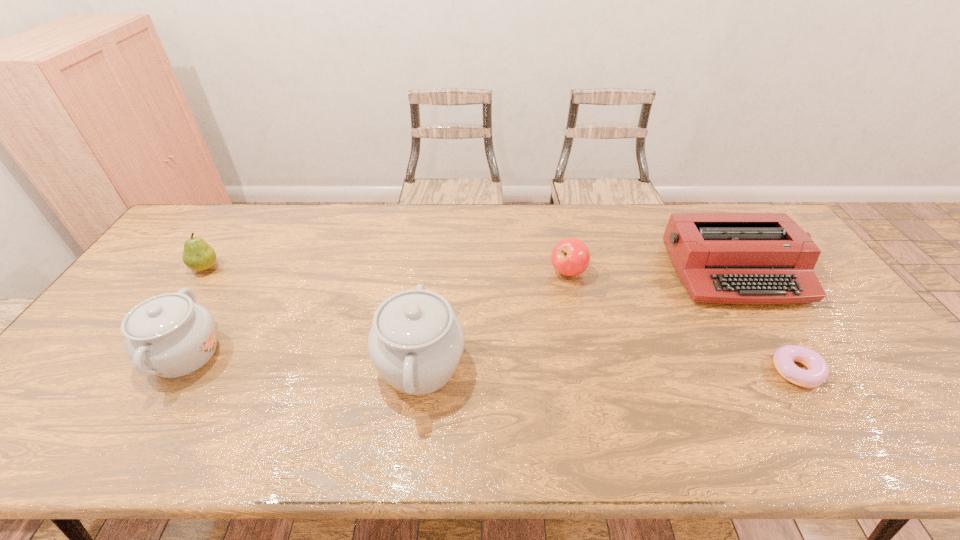
Please show where to add a chinaware on the right while keeping spacing even. Please provide its 2D coordinates. Your answer should be formatted as a tuple, i.e. [(x, y)], where the tuple contains the x and y coordinates of a point satisfying the conditions above.

[(665, 376)]